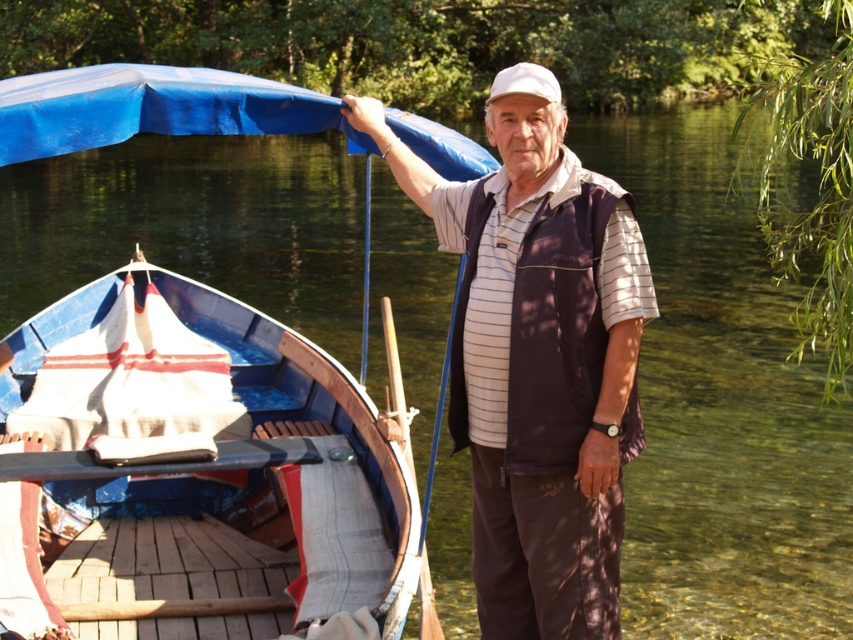
Can you confirm if brown fabric vest at center is smaller than white matte baseball cap at upper center?

Correct, brown fabric vest at center occupies less space than white matte baseball cap at upper center.

You are a GUI agent. You are given a task and a screenshot of the screen. Output one action in this format:
    pyautogui.click(x=<x>, y=<y>)
    Task: Click on the brown fabric vest at center
    
    Given the screenshot: What is the action you would take?
    [x=538, y=365]

Is point (224, 490) behind point (514, 417)?

That is True.

I want to click on blue painted wood boat at left, so click(x=194, y=472).

In the scene shown: Is blue painted wood boat at left positioned before white matte baseball cap at upper center?

No, blue painted wood boat at left is further to the viewer.

Can you confirm if blue painted wood boat at left is positioned above white matte baseball cap at upper center?

Incorrect, blue painted wood boat at left is not positioned above white matte baseball cap at upper center.

What do you see at coordinates (194, 472) in the screenshot? I see `blue painted wood boat at left` at bounding box center [194, 472].

Locate an element on the screen. blue painted wood boat at left is located at coordinates (194, 472).